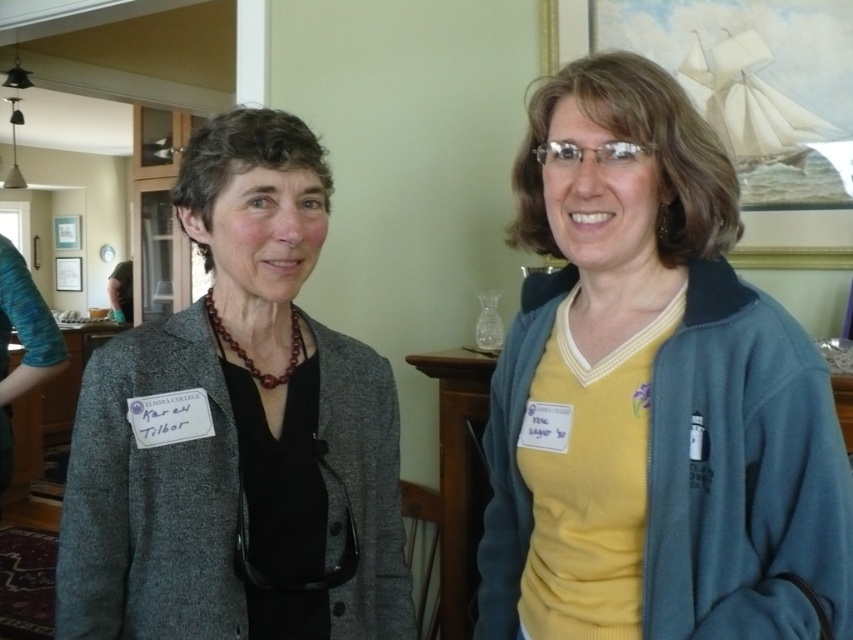
Question: Can you confirm if yellow fleece jacket at right is wider than matte gray blazer at center?

Choices:
 (A) yes
 (B) no

Answer: (B)

Question: Can you confirm if yellow fleece jacket at right is smaller than matte gray blazer at center?

Choices:
 (A) no
 (B) yes

Answer: (A)

Question: Which point appears closest to the camera in this image?

Choices:
 (A) (674, 428)
 (B) (235, 118)

Answer: (A)

Question: Can you confirm if yellow fleece jacket at right is positioned below matte gray blazer at center?

Choices:
 (A) yes
 (B) no

Answer: (B)

Question: Which of the following is the farthest from the observer?

Choices:
 (A) (500, 616)
 (B) (352, 392)

Answer: (A)